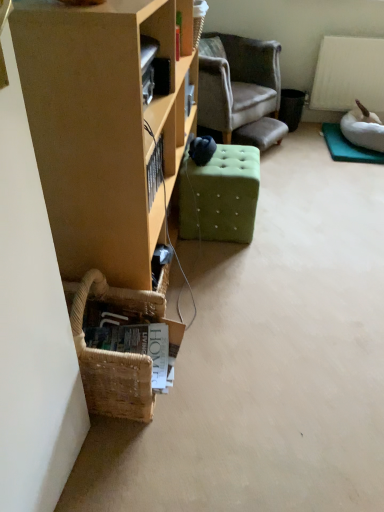
Question: Is velvet gray armchair at center in front of or behind matte wood cabinet at left in the image?

Choices:
 (A) front
 (B) behind

Answer: (B)

Question: From the image's perspective, is velvet gray armchair at center positioned above or below matte wood cabinet at left?

Choices:
 (A) above
 (B) below

Answer: (A)

Question: Based on their relative distances, which object is farther from the woven brown basket at lower left?

Choices:
 (A) green tufted ottoman at center
 (B) velvet gray armchair at center
 (C) matte wood cabinet at left

Answer: (B)

Question: Which is nearer to the woven brown basket at lower left?

Choices:
 (A) velvet gray armchair at center
 (B) matte wood cabinet at left
 (C) green tufted ottoman at center

Answer: (B)